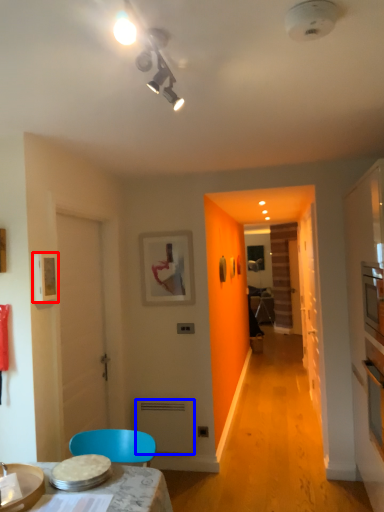
Question: Which point is further to the camera, picture frame (highlighted by a red box) or appliance (highlighted by a blue box)?

Choices:
 (A) picture frame
 (B) appliance

Answer: (B)